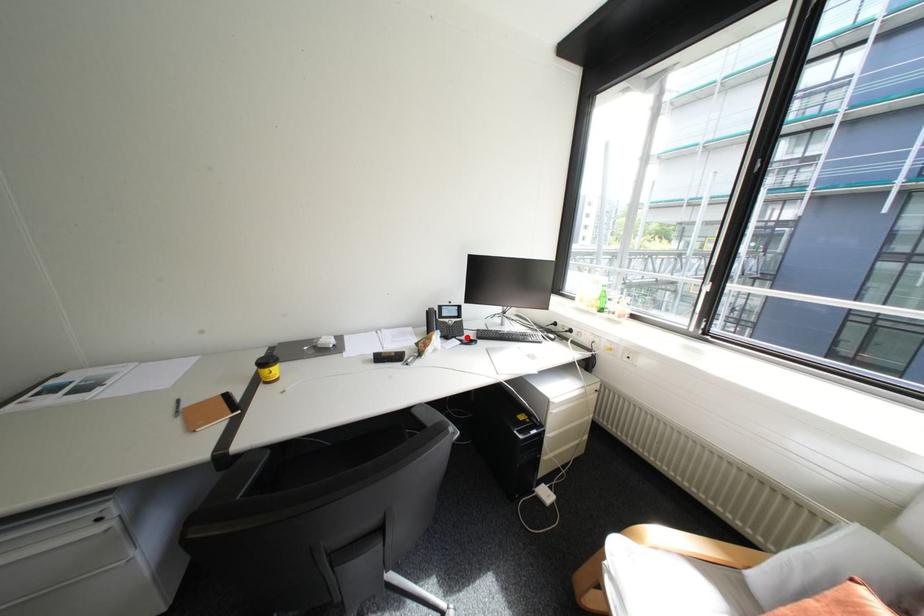
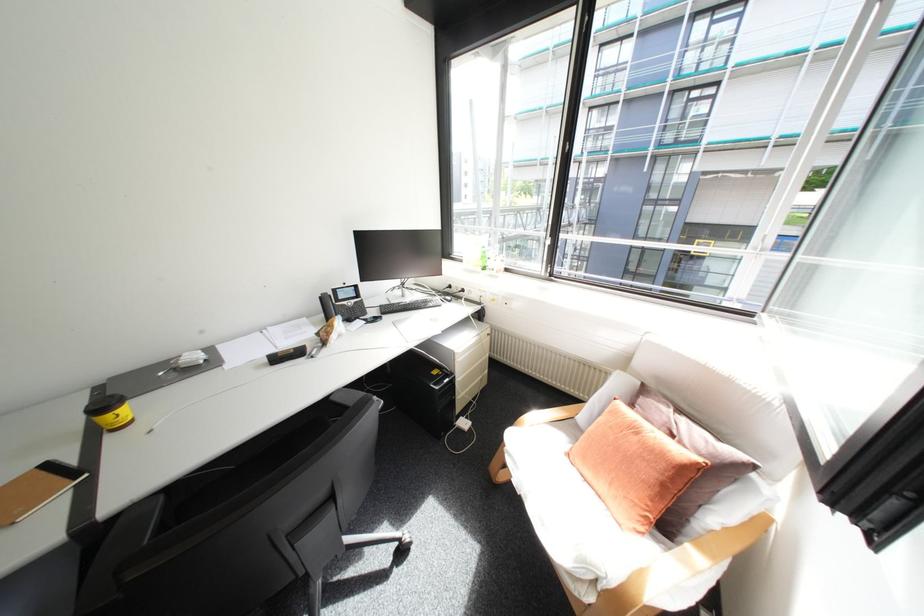
Find the pixel in the second image that matches the highlighted location in the first image.

(371, 317)